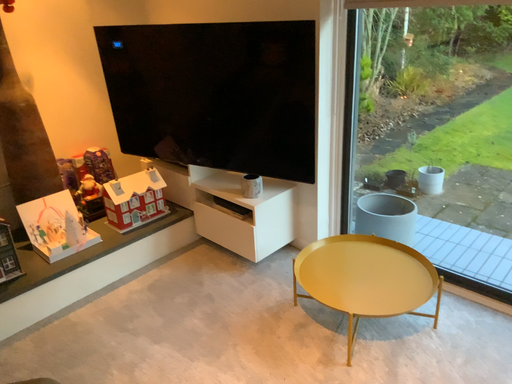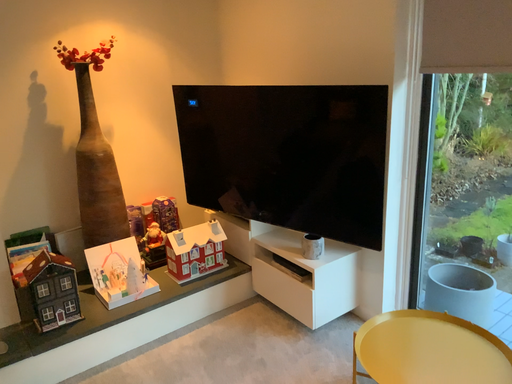
Question: Which way did the camera rotate in the video?

Choices:
 (A) rotated right
 (B) rotated left

Answer: (B)